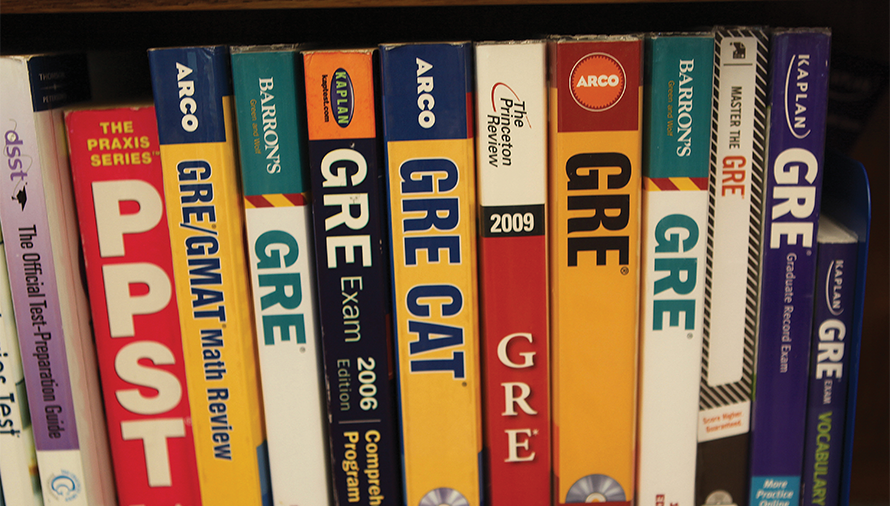
Where is `shelf above books`? This screenshot has height=506, width=890. shelf above books is located at coordinates (30, 5).